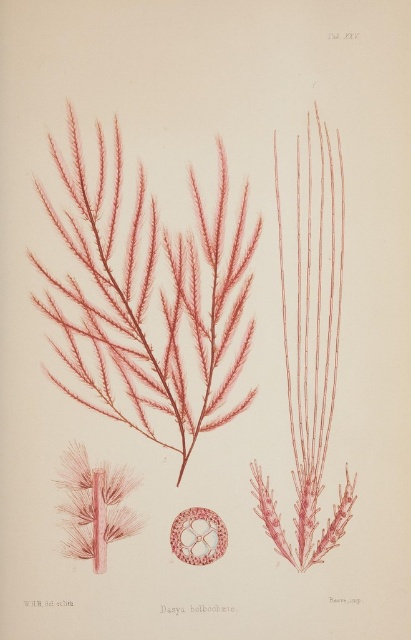
Based on the coordinates provided, what object is located at point (147, 301) in the botanical illustration?

The point (147, 301) corresponds to the matte red seaweed at center.

From the picture: You are standing at point A, which is 4.43 feet away from the point labeled as point (106, 324) in the illustration. If you want to move closer to that point, which direction should you move?

Since you are 4.43 feet away from point (106, 324), moving towards that point would require you to move in the direction of the point. However, without additional spatial context about the layout of the illustration or the environment, it is not possible to determine the specific direction to move. The illustration itself is a flat, 2D representation, so direction would depend on how it is oriented in your view.